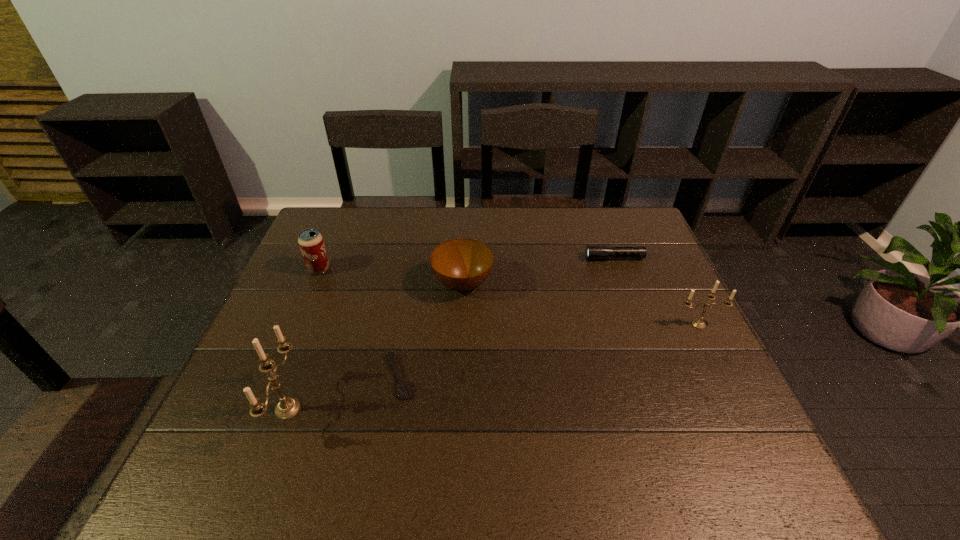
Image resolution: width=960 pixels, height=540 pixels. Find the location of `free space between the fourth object from left to right and the third tallest object`. free space between the fourth object from left to right and the third tallest object is located at coordinates (391, 276).

Where is `free spot between the nearer candle and the rightmost object`? Image resolution: width=960 pixels, height=540 pixels. free spot between the nearer candle and the rightmost object is located at coordinates (493, 367).

At what (x,y) coordinates should I click in order to perform the action: click on vacant area that lies between the left candle and the shorter candle. Please return your answer as a coordinate pair (x, y). This screenshot has width=960, height=540. Looking at the image, I should click on (493, 367).

Select which object is the closest to the fourth tallest object. Please provide its 2D coordinates. Your answer should be formatted as a tuple, i.e. [(x, y)], where the tuple contains the x and y coordinates of a point satisfying the conditions above.

[(403, 388)]

The width and height of the screenshot is (960, 540). I want to click on object that stands as the third closest to the right candle, so click(x=403, y=388).

Identify the location of vacant region that satisfies the following two spatial constraints: 1. at the lens end of the fourth farthest object; 2. on the right side of the fifth object from left to right. Image resolution: width=960 pixels, height=540 pixels. (638, 325).